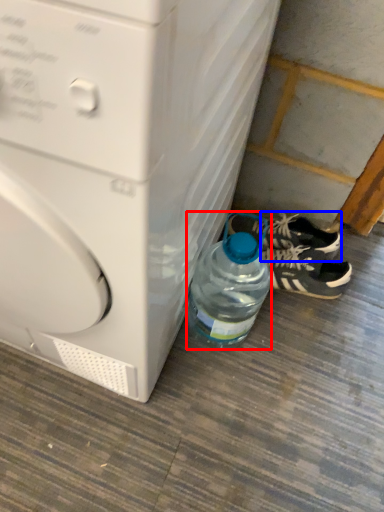
Question: Among these objects, which one is nearest to the camera, bottle (highlighted by a red box) or sneakers (highlighted by a blue box)?

Choices:
 (A) bottle
 (B) sneakers

Answer: (A)